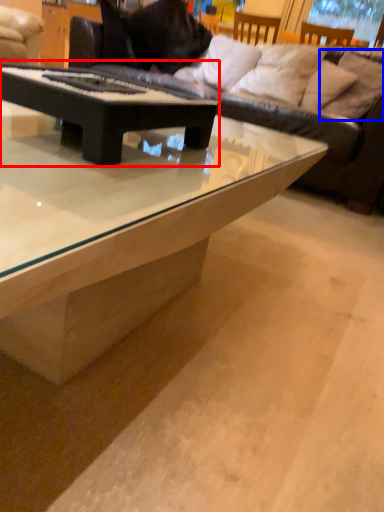
Question: Which of the following is the farthest to the observer, coffee table (highlighted by a red box) or pillow (highlighted by a blue box)?

Choices:
 (A) coffee table
 (B) pillow

Answer: (B)